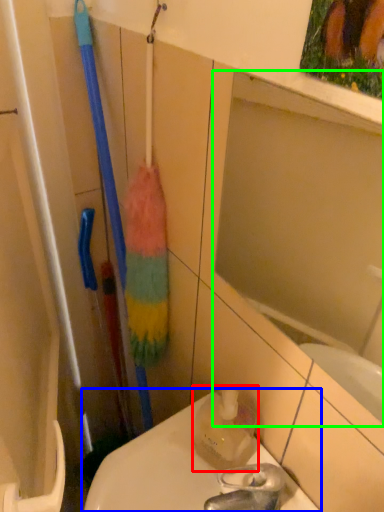
Question: Estimate the real-world distances between objects in this image. Which object is closer to cleaning product (highlighted by a red box), toilet (highlighted by a blue box) or mirror (highlighted by a green box)?

Choices:
 (A) toilet
 (B) mirror

Answer: (A)